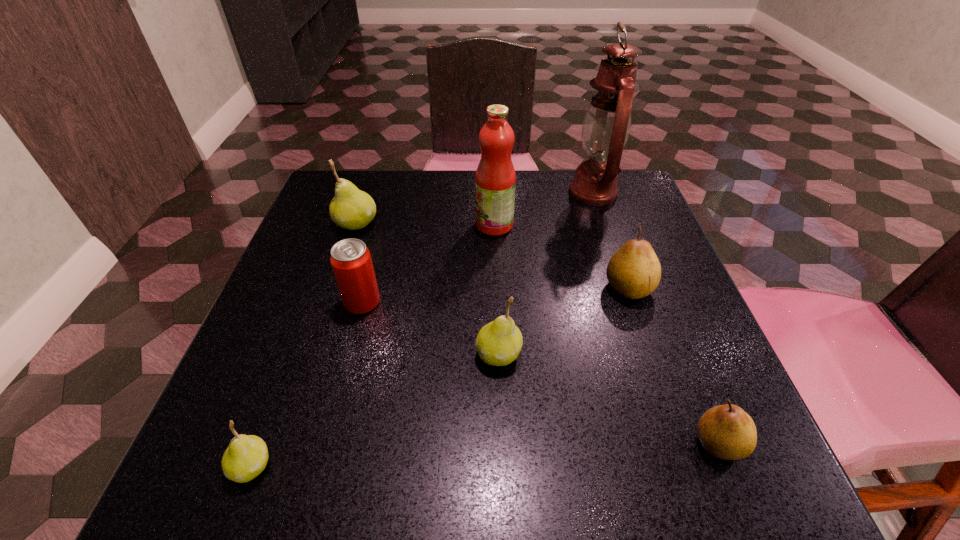
Image resolution: width=960 pixels, height=540 pixels. In order to click on object at the far right corner in this screenshot , I will do `click(606, 127)`.

What are the coordinates of `object that is positioned at the near right corner` in the screenshot? It's located at (727, 432).

The height and width of the screenshot is (540, 960). In the image, there is a desktop. Identify the location of vacant space at the far edge. (543, 205).

In the image, there is a desktop. At what (x,y) coordinates should I click in order to perform the action: click on free region at the near edge. Please return your answer as a coordinate pair (x, y). This screenshot has height=540, width=960. Looking at the image, I should click on (593, 467).

Where is `vacant space at the left edge of the desktop`? The image size is (960, 540). vacant space at the left edge of the desktop is located at coordinates (266, 387).

Identify the location of vacant region at the right edge of the desktop. (675, 286).

Find the location of a particular element. vacant region at the far left corner is located at coordinates (317, 198).

The image size is (960, 540). In the image, there is a desktop. What are the coordinates of `blank space at the near left corner` in the screenshot? It's located at (275, 450).

Where is `free space at the far right corner of the desktop`? Image resolution: width=960 pixels, height=540 pixels. free space at the far right corner of the desktop is located at coordinates (622, 183).

The height and width of the screenshot is (540, 960). In order to click on vacant space that is in between the fruit juice and the second smallest green pear in this screenshot , I will do (496, 289).